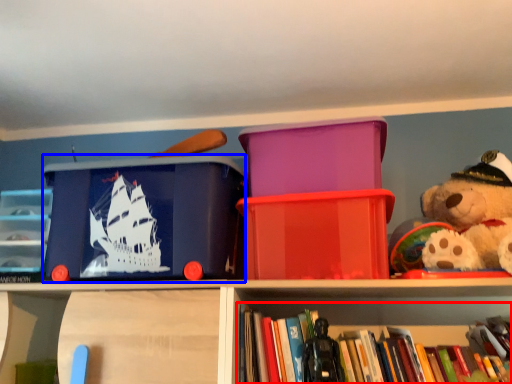
Question: Which point is further to the camera, book (highlighted by a red box) or storage box (highlighted by a blue box)?

Choices:
 (A) book
 (B) storage box

Answer: (B)